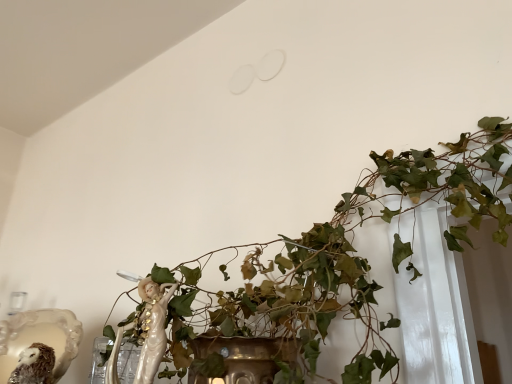
Question: Would you say green leafy plant at center is to the left or to the right of fuzzy brown owl at lower left in the picture?

Choices:
 (A) right
 (B) left

Answer: (A)

Question: Relative to fuzzy brown owl at lower left, is green leafy plant at center in front or behind?

Choices:
 (A) behind
 (B) front

Answer: (B)

Question: In terms of height, does green leafy plant at center look taller or shorter compared to fuzzy brown owl at lower left?

Choices:
 (A) tall
 (B) short

Answer: (A)

Question: In the image, is fuzzy brown owl at lower left positioned in front of or behind green leafy plant at center?

Choices:
 (A) behind
 (B) front

Answer: (A)

Question: From a real-world perspective, relative to green leafy plant at center, is fuzzy brown owl at lower left vertically above or below?

Choices:
 (A) above
 (B) below

Answer: (B)

Question: Considering the positions of fuzzy brown owl at lower left and green leafy plant at center in the image, is fuzzy brown owl at lower left taller or shorter than green leafy plant at center?

Choices:
 (A) short
 (B) tall

Answer: (A)

Question: Based on their positions, is fuzzy brown owl at lower left located to the left or right of green leafy plant at center?

Choices:
 (A) right
 (B) left

Answer: (B)